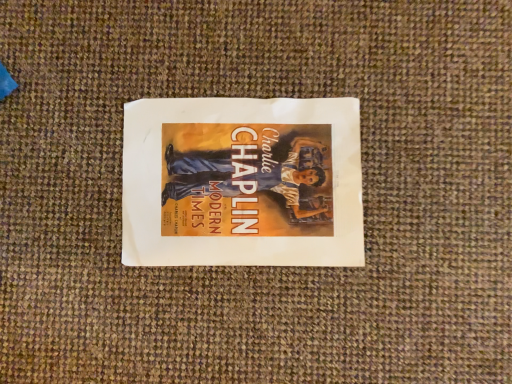
Locate an element on the screen. free space above matte paper poster at center (from a real-world perspective) is located at coordinates (234, 177).